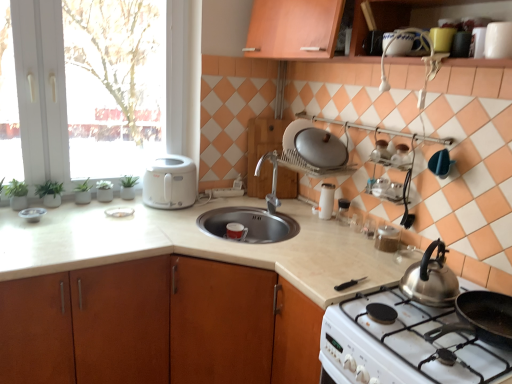
Question: Are satin silver lid at upper center, which is counted as the second kitchen appliance, starting from the right, and green matte plant at left making contact?

Choices:
 (A) yes
 (B) no

Answer: (B)

Question: Is satin silver lid at upper center, placed as the second kitchen appliance when sorted from left to right, to the left of green matte plant at left from the viewer's perspective?

Choices:
 (A) yes
 (B) no

Answer: (B)

Question: Can you confirm if satin silver lid at upper center, which is counted as the second kitchen appliance, starting from the right, is smaller than green matte plant at left?

Choices:
 (A) no
 (B) yes

Answer: (A)

Question: From the image's perspective, is satin silver lid at upper center, which is counted as the second kitchen appliance, starting from the right, located beneath green matte plant at left?

Choices:
 (A) yes
 (B) no

Answer: (B)

Question: Is satin silver lid at upper center, which is counted as the second kitchen appliance, starting from the right, turned away from green matte plant at left?

Choices:
 (A) no
 (B) yes

Answer: (A)

Question: From their relative heights in the image, would you say clear glass salt and pepper shakers at center, the 1th appliance in the back-to-front sequence, is taller or shorter than white glossy salt shaker at center, placed as the 1th kitchen appliance when sorted from right to left?

Choices:
 (A) short
 (B) tall

Answer: (A)

Question: From the image's perspective, is clear glass salt and pepper shakers at center, the 4th appliance in the right-to-left sequence, located above or below white glossy salt shaker at center, placed as the 1th kitchen appliance when sorted from right to left?

Choices:
 (A) below
 (B) above

Answer: (A)

Question: In the image, is clear glass salt and pepper shakers at center, the 4th appliance in the right-to-left sequence, on the left side or the right side of white glossy salt shaker at center, placed as the 1th kitchen appliance when sorted from right to left?

Choices:
 (A) right
 (B) left

Answer: (A)

Question: Do you think clear glass salt and pepper shakers at center, the 4th appliance in the right-to-left sequence, is within white glossy salt shaker at center, placed as the 1th kitchen appliance when sorted from right to left, or outside of it?

Choices:
 (A) outside
 (B) inside

Answer: (A)

Question: From a real-world perspective, is white glossy salt shaker at center, acting as the 3th kitchen appliance starting from the left, positioned above or below clear glass jar at upper right, which appears as the second appliance when viewed from the right?

Choices:
 (A) above
 (B) below

Answer: (A)

Question: Considering the positions of white glossy salt shaker at center, acting as the 3th kitchen appliance starting from the left, and clear glass jar at upper right, acting as the 6th appliance starting from the top, in the image, is white glossy salt shaker at center, acting as the 3th kitchen appliance starting from the left, bigger or smaller than clear glass jar at upper right, acting as the 6th appliance starting from the top,?

Choices:
 (A) big
 (B) small

Answer: (A)

Question: Considering the relative positions of white glossy salt shaker at center, placed as the 1th kitchen appliance when sorted from right to left, and clear glass jar at upper right, which is the first appliance in bottom-to-top order, in the image provided, is white glossy salt shaker at center, placed as the 1th kitchen appliance when sorted from right to left, to the left or to the right of clear glass jar at upper right, which is the first appliance in bottom-to-top order,?

Choices:
 (A) left
 (B) right

Answer: (A)

Question: Looking at their shapes, would you say white glossy salt shaker at center, acting as the 3th kitchen appliance starting from the left, is wider or thinner than clear glass jar at upper right, the 2th appliance in the front-to-back sequence?

Choices:
 (A) wide
 (B) thin

Answer: (B)

Question: Is white glossy plate at left, the second appliance positioned from the back, spatially inside satin silver lid at upper center, which is counted as the second kitchen appliance, starting from the right, or outside of it?

Choices:
 (A) outside
 (B) inside

Answer: (A)

Question: Is white glossy plate at left, the 3th appliance viewed from the top, in front of or behind satin silver lid at upper center, which is counted as the second kitchen appliance, starting from the right, in the image?

Choices:
 (A) front
 (B) behind

Answer: (B)